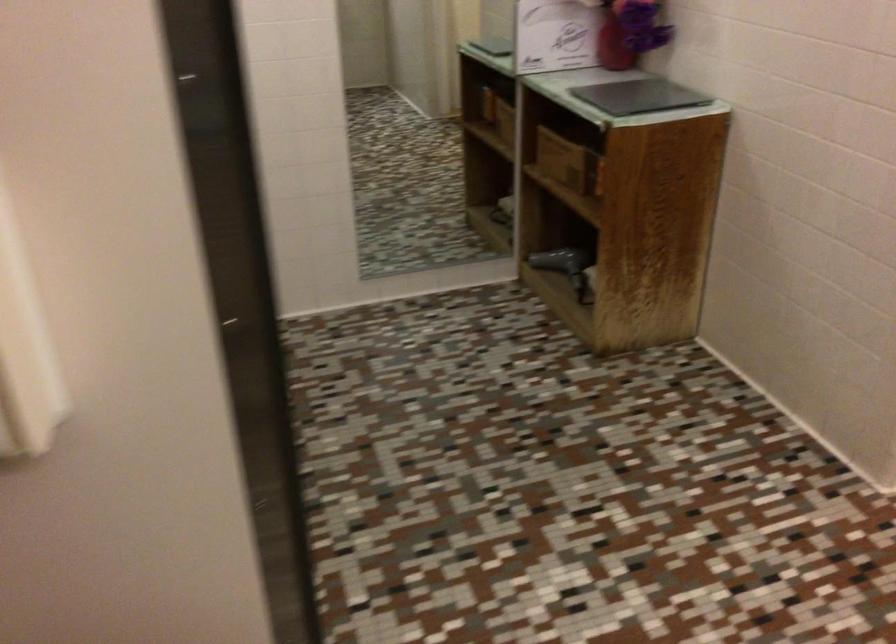
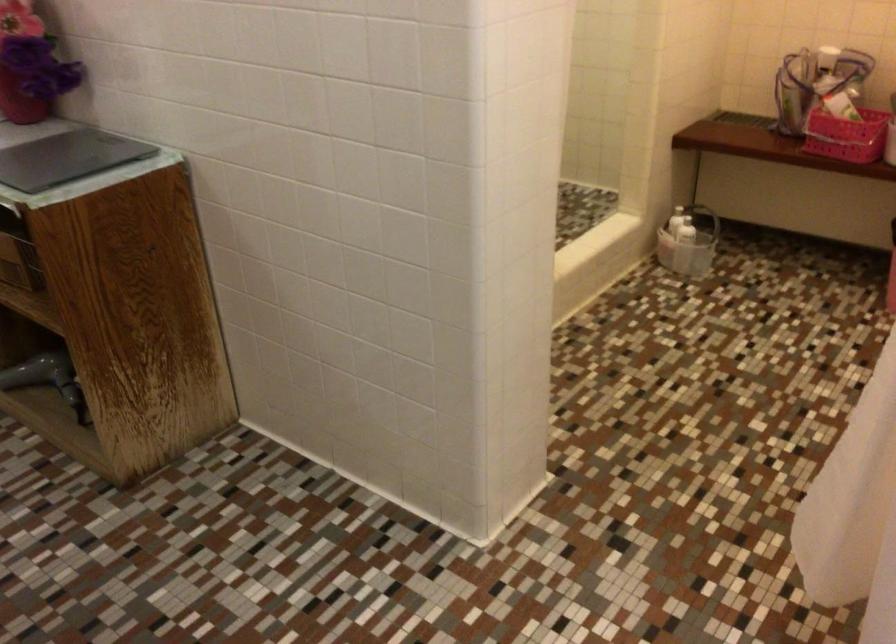
Find the pixel in the second image that matches (562,266) in the first image.

(47, 379)